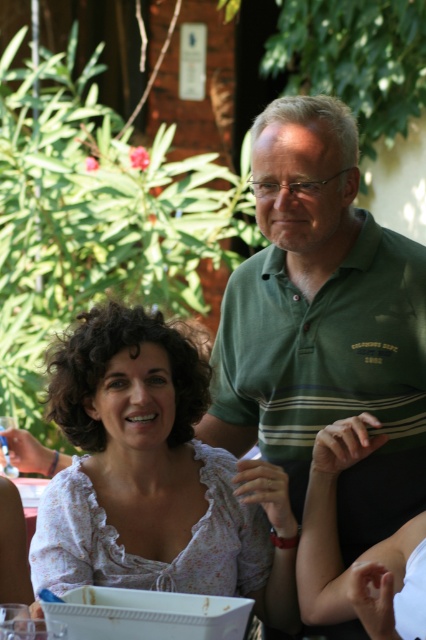
You are a photographer setting up for a group photo. The two subjects are wearing the green striped polo shirt at center and the white floral blouse at center. To ensure both are in frame, what minimum distance should you maintain between them?

The minimum distance to maintain between the green striped polo shirt at center and the white floral blouse at center should be at least 36.87 centimeters to ensure both are in frame.

You are standing at the point with coordinates point (74, 406) and want to walk to the point with coordinates point (330, 248). Is the destination point behind you or in front of you?

The destination point (330, 248) is behind point (74, 406), so it is behind you.

You are a photographer taking a picture of two people sitting at a table. You want to ensure that the person wearing the green striped polo shirt at center is positioned to the right of the white floral blouse at center. Based on the scene description, does the current arrangement meet your requirement?

Yes, the current arrangement meets your requirement because the green striped polo shirt at center is indeed positioned to the right of the white floral blouse at center as described in the Objects Description.